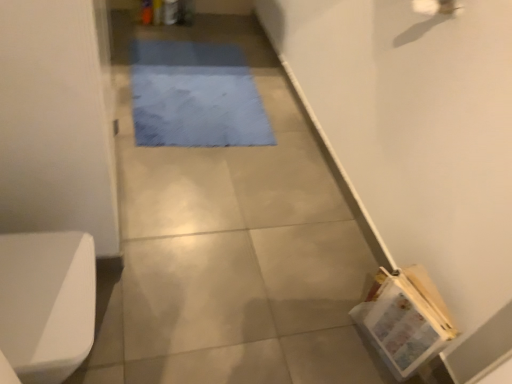
Question: Is blue fabric mat at center further to the viewer compared to white glossy toilet bowl at lower left?

Choices:
 (A) no
 (B) yes

Answer: (B)

Question: Is the surface of blue fabric mat at center in direct contact with white glossy toilet bowl at lower left?

Choices:
 (A) yes
 (B) no

Answer: (B)

Question: From the image's perspective, is blue fabric mat at center located beneath white glossy toilet bowl at lower left?

Choices:
 (A) yes
 (B) no

Answer: (B)

Question: Is blue fabric mat at center positioned beyond the bounds of white glossy toilet bowl at lower left?

Choices:
 (A) yes
 (B) no

Answer: (A)

Question: Is blue fabric mat at center looking in the opposite direction of white glossy toilet bowl at lower left?

Choices:
 (A) no
 (B) yes

Answer: (A)

Question: Does blue fabric mat at center have a lesser height compared to white glossy toilet bowl at lower left?

Choices:
 (A) yes
 (B) no

Answer: (A)

Question: Considering the relative sizes of white glossy toilet bowl at lower left and blue fabric mat at center in the image provided, is white glossy toilet bowl at lower left taller than blue fabric mat at center?

Choices:
 (A) no
 (B) yes

Answer: (B)

Question: Considering the relative sizes of white glossy toilet bowl at lower left and blue fabric mat at center in the image provided, is white glossy toilet bowl at lower left wider than blue fabric mat at center?

Choices:
 (A) no
 (B) yes

Answer: (A)

Question: Is the depth of white glossy toilet bowl at lower left less than that of blue fabric mat at center?

Choices:
 (A) yes
 (B) no

Answer: (A)

Question: From a real-world perspective, is white glossy toilet bowl at lower left under blue fabric mat at center?

Choices:
 (A) yes
 (B) no

Answer: (B)

Question: Can you confirm if white glossy toilet bowl at lower left is bigger than blue fabric mat at center?

Choices:
 (A) no
 (B) yes

Answer: (B)

Question: Is white glossy toilet bowl at lower left further to the viewer compared to blue fabric mat at center?

Choices:
 (A) yes
 (B) no

Answer: (B)

Question: Based on their positions, is blue fabric mat at center located to the left or right of white glossy toilet bowl at lower left?

Choices:
 (A) right
 (B) left

Answer: (A)